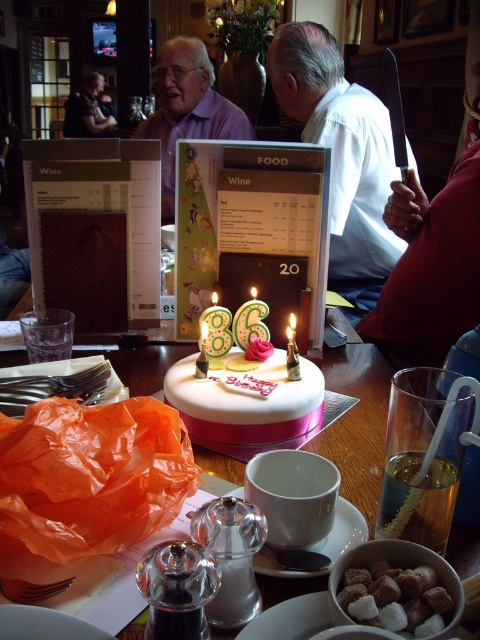
You are a customer at the restaurant and want to choose a shirt from the two displayed at the upper center. The white shirt at upper center and the matte purple shirt at upper center. Which one is narrower?

The white shirt at upper center is thinner than the matte purple shirt at upper center, so the white shirt at upper center is narrower.

You are standing in a restaurant and see the white shirt at upper center. If you want to reach out and touch it, would you be able to do so without moving your feet?

The white shirt at upper center is 4.93 feet away from you, so you cannot reach it without moving your feet since the average human arm span is about 3 feet.

You are a delivery person who needs to place a rectangular box that is 12 inches long and 14 inches wide on the table between the point at coordinates (172, 374) and the other object. Will the box fit without overlapping either object?

The distance between the point at coordinates (172, 374) and the other object is 33.94 inches. The box is 14 inches wide, so there is enough space between them to place the box without overlapping.